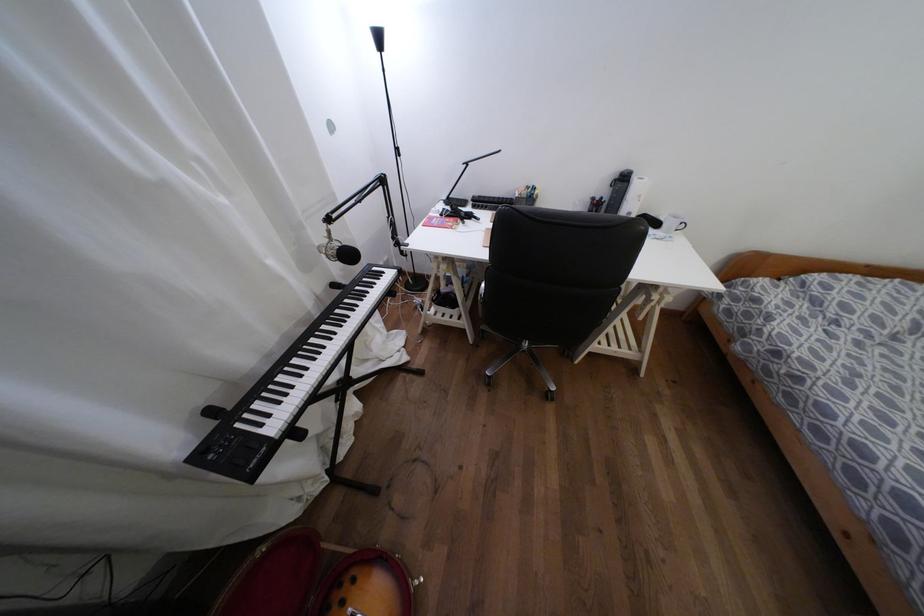
Find the location of `keyboard key`. keyboard key is located at coordinates (292, 384).